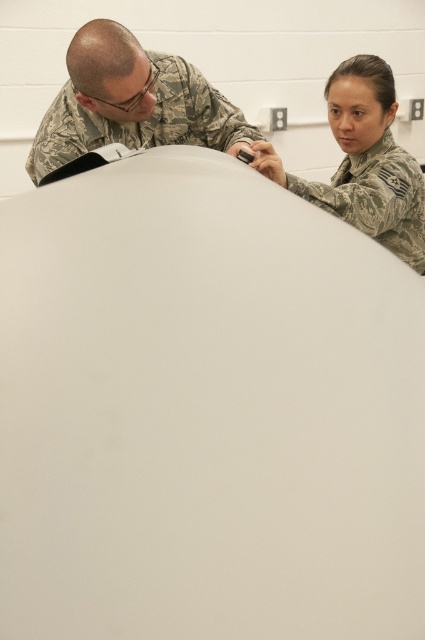
Question: Does camouflage uniform at upper left appear on the right side of camouflage uniform at upper right?

Choices:
 (A) no
 (B) yes

Answer: (A)

Question: Which point is farther to the camera?

Choices:
 (A) (388, 102)
 (B) (161, 72)

Answer: (A)

Question: Among these objects, which one is nearest to the camera?

Choices:
 (A) camouflage uniform at upper left
 (B) camouflage uniform at upper right

Answer: (A)

Question: Which point appears closest to the camera in this image?

Choices:
 (A) (413, 228)
 (B) (135, 61)

Answer: (B)

Question: Does camouflage uniform at upper left have a smaller size compared to camouflage uniform at upper right?

Choices:
 (A) no
 (B) yes

Answer: (B)

Question: Does camouflage uniform at upper left appear on the left side of camouflage uniform at upper right?

Choices:
 (A) no
 (B) yes

Answer: (B)